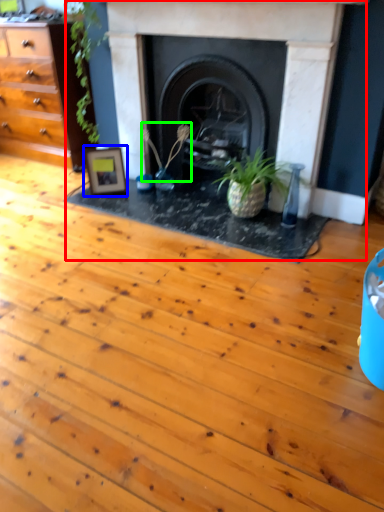
Question: Which is farther away from fireplace (highlighted by a red box)? picture frame (highlighted by a blue box) or plant (highlighted by a green box)?

Choices:
 (A) picture frame
 (B) plant

Answer: (A)